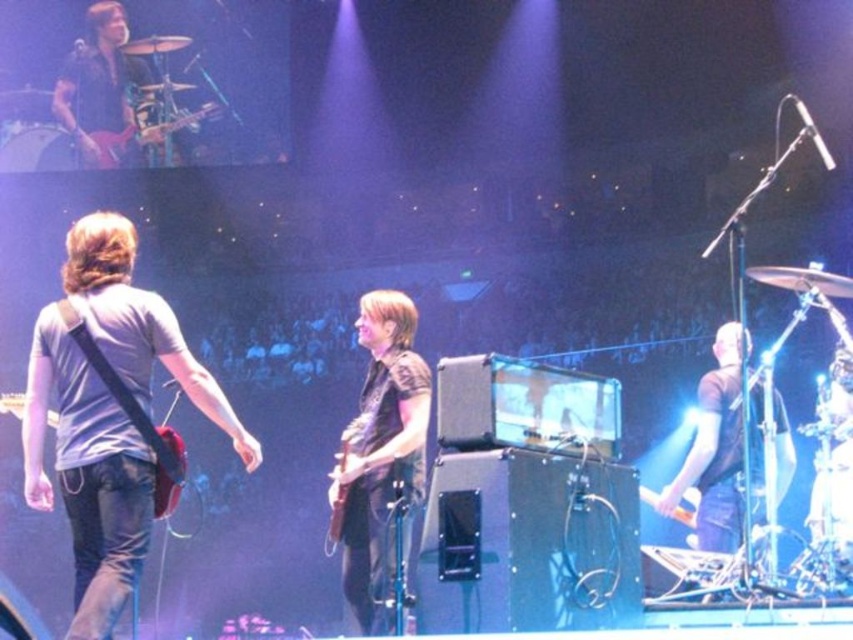
You are a photographer positioned at the center of the stage. You want to capture a closeup shot of the shiny black guitar at upper left. Given that your camera has a focal length of 50mm and you are 3 meters away from the guitar, will you be able to fill the frame with the guitar?

The position of shiny black guitar at upper left is at point (x=103, y=90), so the photographer will need to adjust their position or zoom to ensure the guitar fills the frame.

You are a stagehand setting up microphones for the guitars. The shiny black guitar at upper left is smaller than the matte black electric guitar at left. Which guitar should you place the microphone closer to if you need to capture the sound more effectively?

The shiny black guitar at upper left is smaller than the matte black electric guitar at left. Since smaller guitars may require closer microphone placement for optimal sound capture, you should place the microphone closer to the shiny black guitar at upper left.